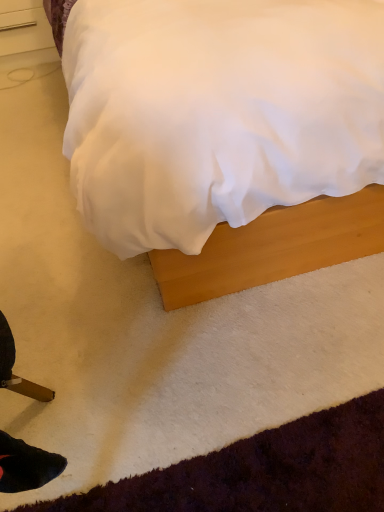
Question: Considering their positions, is wooden bed at center located in front of or behind brushed metal drawer at upper left?

Choices:
 (A) front
 (B) behind

Answer: (A)

Question: From a real-world perspective, is wooden bed at center above or below brushed metal drawer at upper left?

Choices:
 (A) below
 (B) above

Answer: (B)

Question: Is wooden bed at center situated inside brushed metal drawer at upper left or outside?

Choices:
 (A) outside
 (B) inside

Answer: (A)

Question: Based on their positions, is brushed metal drawer at upper left located to the left or right of wooden bed at center?

Choices:
 (A) right
 (B) left

Answer: (B)

Question: Is point (9, 30) closer or farther from the camera than point (284, 208)?

Choices:
 (A) closer
 (B) farther

Answer: (B)

Question: Considering their positions, is brushed metal drawer at upper left located in front of or behind wooden bed at center?

Choices:
 (A) behind
 (B) front

Answer: (A)

Question: Based on their sizes in the image, would you say brushed metal drawer at upper left is bigger or smaller than wooden bed at center?

Choices:
 (A) big
 (B) small

Answer: (B)